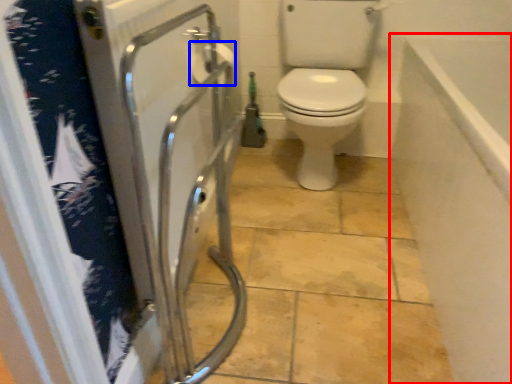
Question: Among these objects, which one is nearest to the camera, bath (highlighted by a red box) or toilet paper (highlighted by a blue box)?

Choices:
 (A) bath
 (B) toilet paper

Answer: (A)